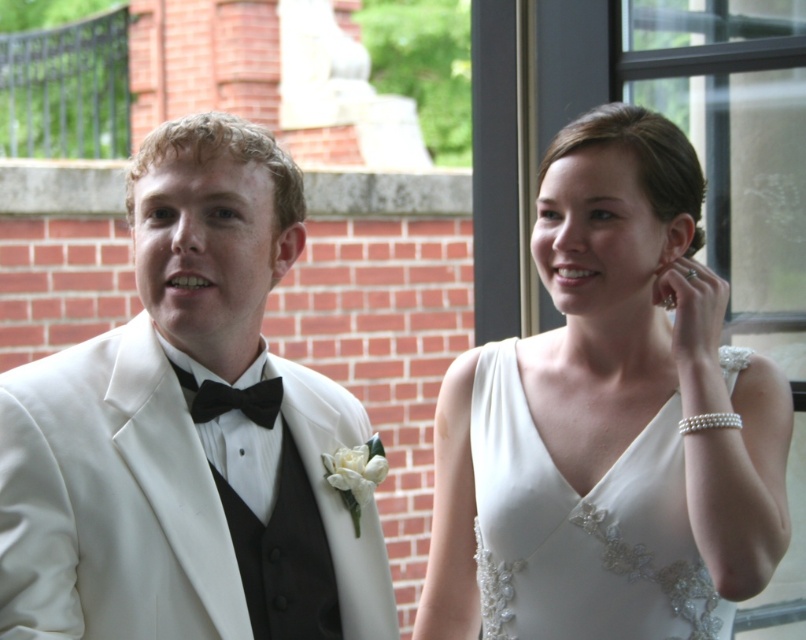
Between white satin dress at upper right and black velvet bow tie at center, which one is positioned higher?

black velvet bow tie at center

What do you see at coordinates (582, 529) in the screenshot?
I see `white satin dress at upper right` at bounding box center [582, 529].

Where is `white satin dress at upper right`? white satin dress at upper right is located at coordinates (582, 529).

Can you confirm if white satin tuxedo at left is positioned to the right of white satin dress at center?

No, white satin tuxedo at left is not to the right of white satin dress at center.

Can you confirm if white satin tuxedo at left is wider than white satin dress at center?

In fact, white satin tuxedo at left might be narrower than white satin dress at center.

The height and width of the screenshot is (640, 806). Find the location of `white satin tuxedo at left`. white satin tuxedo at left is located at coordinates (187, 433).

Between white satin tuxedo at left and white satin dress at upper right, which one is positioned higher?

Positioned higher is white satin tuxedo at left.

Does white satin tuxedo at left have a smaller size compared to white satin dress at upper right?

No, white satin tuxedo at left is not smaller than white satin dress at upper right.

Which is behind, point (118, 387) or point (567, 625)?

Positioned behind is point (567, 625).

Where is `white satin tuxedo at left`? The width and height of the screenshot is (806, 640). white satin tuxedo at left is located at coordinates (187, 433).